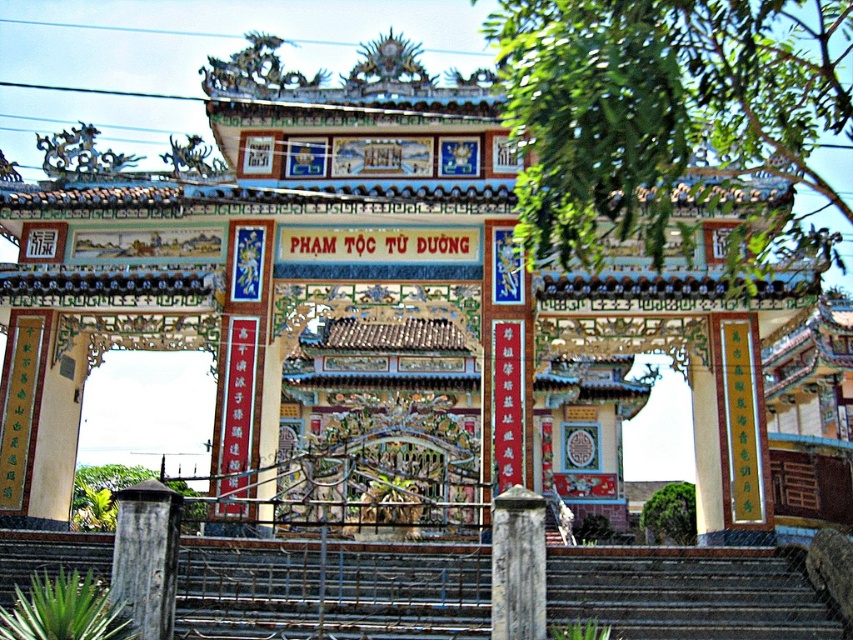
Question: Is dark brown wooden post at lower left to the left of gray weathered stone pillar at center from the viewer's perspective?

Choices:
 (A) yes
 (B) no

Answer: (A)

Question: Which of the following is the closest to the observer?

Choices:
 (A) rusty metal stairs at center
 (B) gray weathered stone pillar at center

Answer: (B)

Question: Can you confirm if dark brown wooden post at lower left is positioned above gray weathered stone pillar at center?

Choices:
 (A) yes
 (B) no

Answer: (B)

Question: Is dark brown wooden post at lower left to the right of gray weathered stone pillar at center from the viewer's perspective?

Choices:
 (A) yes
 (B) no

Answer: (B)

Question: Which is farther from the rusty metal stairs at center?

Choices:
 (A) gray weathered stone pillar at center
 (B) dark brown wooden post at lower left

Answer: (B)

Question: Which of the following is the closest to the observer?

Choices:
 (A) dark brown wooden post at lower left
 (B) rusty metal stairs at center
 (C) gray weathered stone pillar at center

Answer: (C)